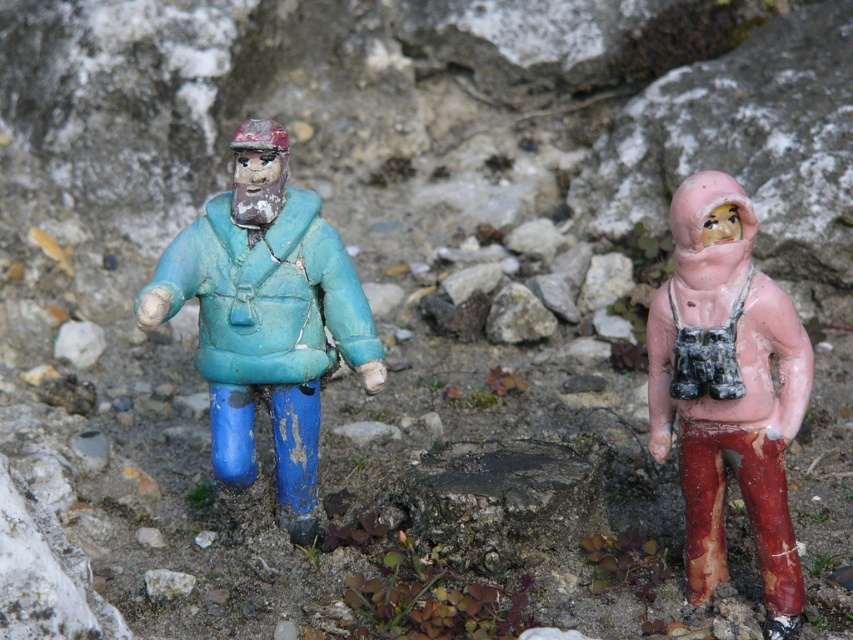
Consider the image. Is matte blue plastic figure at left to the right of pink matte figure at right from the viewer's perspective?

In fact, matte blue plastic figure at left is to the left of pink matte figure at right.

The width and height of the screenshot is (853, 640). What do you see at coordinates (265, 316) in the screenshot? I see `matte blue plastic figure at left` at bounding box center [265, 316].

Image resolution: width=853 pixels, height=640 pixels. In order to click on matte blue plastic figure at left in this screenshot , I will do `click(265, 316)`.